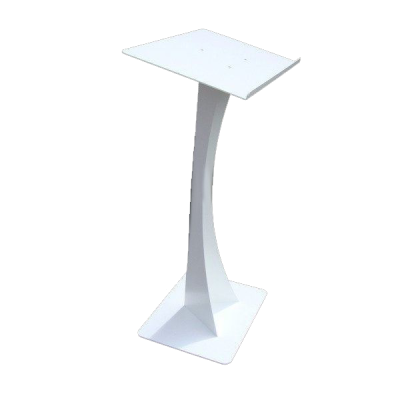
Where is `podium stand`? podium stand is located at coordinates (199, 169).